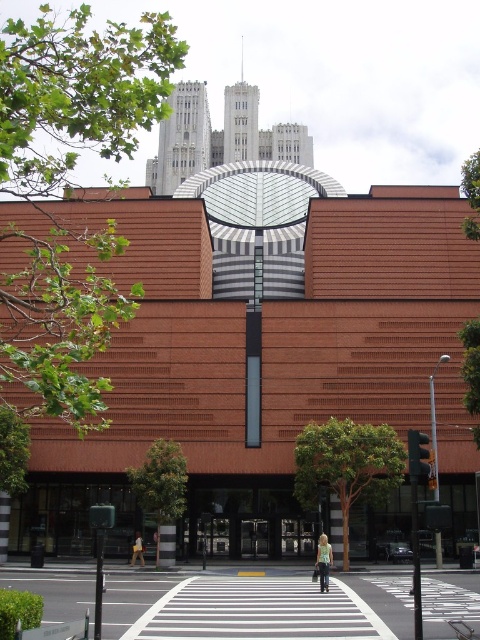
Can you confirm if denim jacket at center is taller than light brown leather jacket at center?

Yes, denim jacket at center is taller than light brown leather jacket at center.

Does denim jacket at center have a lesser height compared to light brown leather jacket at center?

No.

Does point (321, 582) lie in front of point (139, 541)?

Yes, it is in front of point (139, 541).

Where is `denim jacket at center`? The height and width of the screenshot is (640, 480). denim jacket at center is located at coordinates (324, 561).